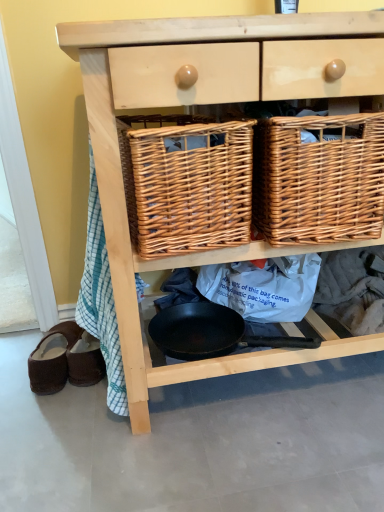
Where is `vacant area that is in front of brown suede slippers at lower left, which is the second footwear from right to left`? The height and width of the screenshot is (512, 384). vacant area that is in front of brown suede slippers at lower left, which is the second footwear from right to left is located at coordinates (51, 413).